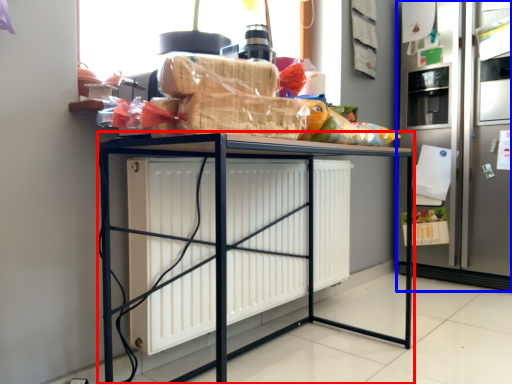
Question: Which object is further to the camera taking this photo, furniture (highlighted by a red box) or fridge (highlighted by a blue box)?

Choices:
 (A) furniture
 (B) fridge

Answer: (B)